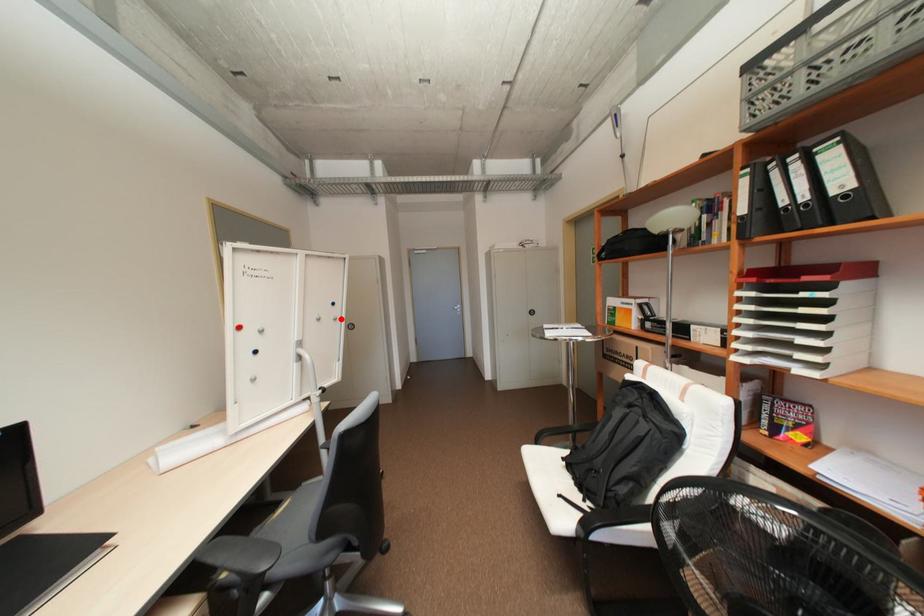
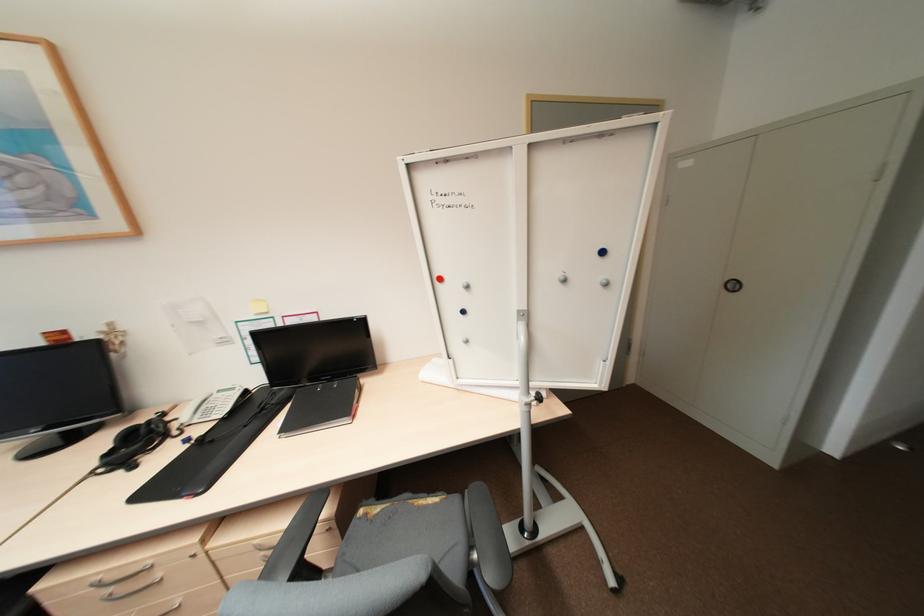
Find the pixel in the second image that matches the highlighted location in the first image.

(612, 284)